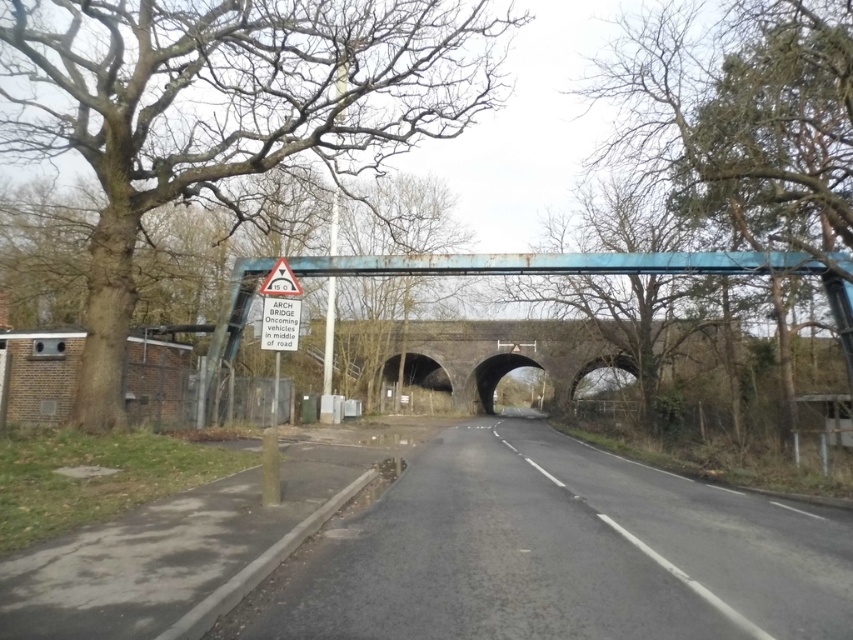
Question: Which object appears farthest from the camera in this image?

Choices:
 (A) green leafy tree at upper center
 (B) blue metallic bridge at center
 (C) rusty metal bridge at center

Answer: (C)

Question: Where is green leafy tree at upper center located in relation to rusty metal bridge at center in the image?

Choices:
 (A) above
 (B) below

Answer: (A)

Question: From the image, what is the correct spatial relationship of green leafy tree at upper center in relation to white triangular warning sign at upper center?

Choices:
 (A) left
 (B) right

Answer: (B)

Question: Is green leafy tree at upper center above blue metallic bridge at center?

Choices:
 (A) yes
 (B) no

Answer: (A)

Question: Estimate the real-world distances between objects in this image. Which object is closer to the rusty metal bridge at center?

Choices:
 (A) blue metallic bridge at center
 (B) green leafy tree at upper center

Answer: (A)

Question: Which is nearer to the green leafy tree at upper center?

Choices:
 (A) white triangular warning sign at upper center
 (B) bare wood tree at left
 (C) blue metallic bridge at center
 (D) rusty metal bridge at center

Answer: (C)